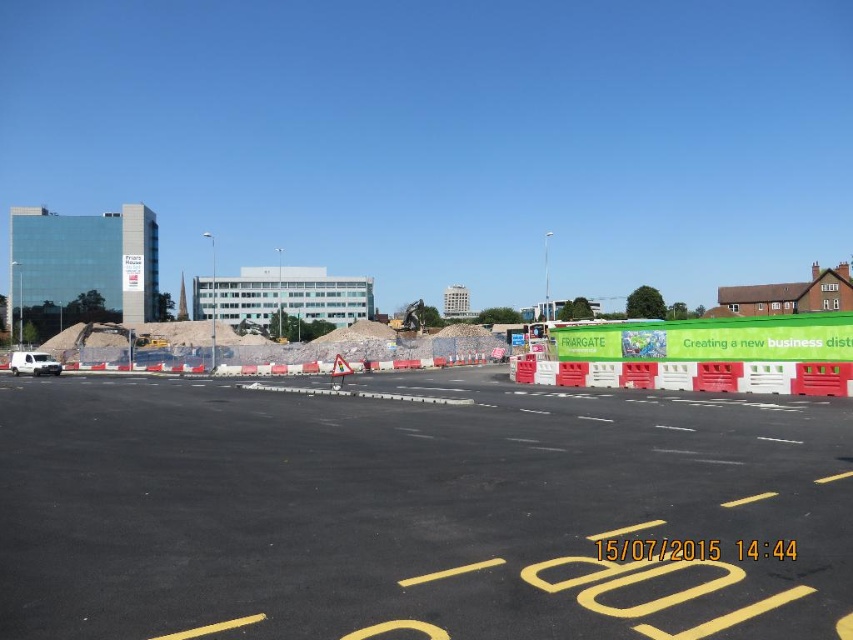
You are a delivery driver arriving at the urban construction site. You need to park your white matte van at lower left near the black asphalt parking lot at center. Given the distance between them is exactly 429.31 feet, can you safely drive your van directly from your current position to the parking lot without any obstacles?

The black asphalt parking lot at center and white matte van at lower left are 429.31 feet apart. Since there are no mentioned obstacles between them in the provided scene description, you can safely drive the van directly to the parking lot.

You are a delivery driver arriving at the construction site. Your GPS shows a point at coordinates (410, 509). Where does this point indicate?

The point at coordinates (410, 509) marks the black asphalt parking lot at center.